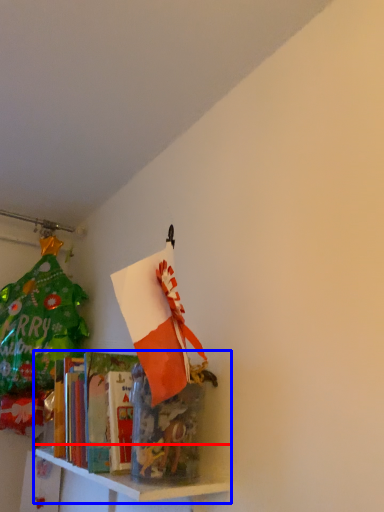
Question: Which point is further to the camera, shelf (highlighted by a red box) or shelf (highlighted by a blue box)?

Choices:
 (A) shelf
 (B) shelf

Answer: (B)